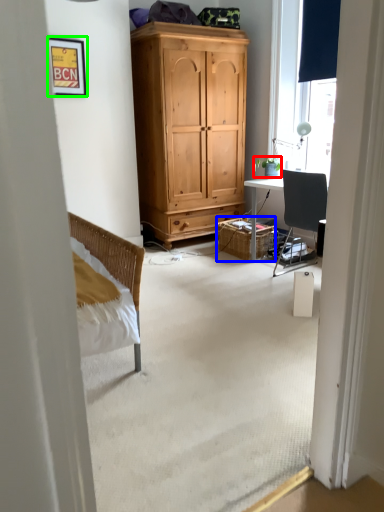
Question: Estimate the real-world distances between objects in this image. Which object is farther from houseplant (highlighted by a red box), picnic basket (highlighted by a blue box) or picture frame (highlighted by a green box)?

Choices:
 (A) picnic basket
 (B) picture frame

Answer: (B)